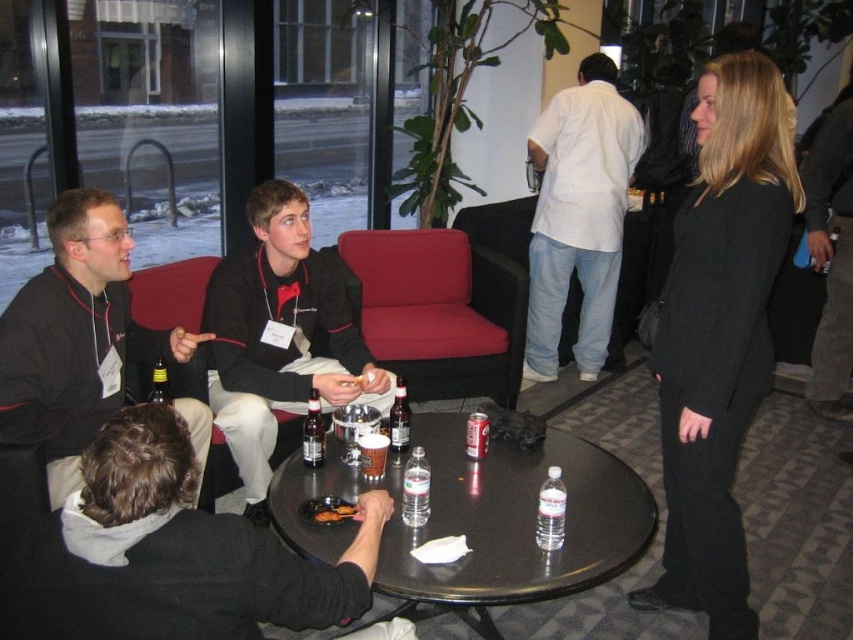
You are a photographer at the event and want to take a photo of both the matte black shirt at center and the white cotton shirt at center. Which shirt should you focus on first to ensure both are in focus?

The matte black shirt at center is closer to the viewer than the white cotton shirt at center. To ensure both are in focus, you should focus on the matte black shirt at center first, as it is closer, and the white cotton shirt at center will be in the depth of field range.

Looking at this image, you are a photographer at the event and want to capture a photo of both the black wool suit at right and the matte black shirt at center. Which person should you focus on first to ensure they are in the frame?

You should focus on the black wool suit at right first because it is taller than the matte black shirt at center, ensuring it fits within the frame.